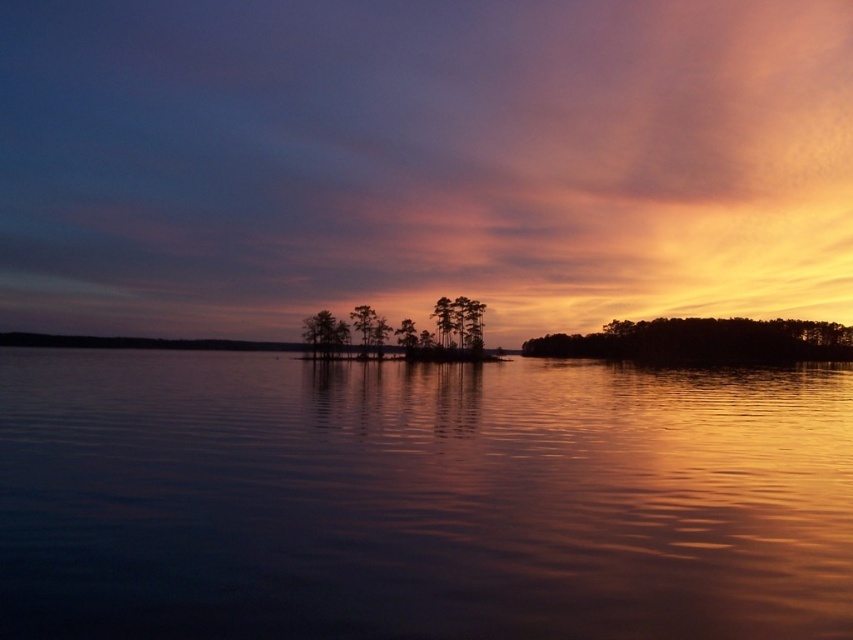
Which is above, orange/yellow cloud at upper center or silhouette pine tree at center?

orange/yellow cloud at upper center is above.

Is orange/yellow cloud at upper center bigger than silhouette pine tree at center?

Indeed, orange/yellow cloud at upper center has a larger size compared to silhouette pine tree at center.

Locate an element on the screen. This screenshot has width=853, height=640. orange/yellow cloud at upper center is located at coordinates (421, 163).

Is orange/yellow cloud at upper center closer to the viewer compared to silhouette tree at center?

No, it is not.

Who is more distant from viewer, (564, 298) or (364, 348)?

Point (564, 298)

This screenshot has height=640, width=853. What do you see at coordinates (421, 163) in the screenshot?
I see `orange/yellow cloud at upper center` at bounding box center [421, 163].

I want to click on orange/yellow cloud at upper center, so click(x=421, y=163).

I want to click on silky smooth trees at center, so click(x=447, y=332).

Is point (445, 346) closer to camera compared to point (442, 317)?

No, it is behind (442, 317).

The width and height of the screenshot is (853, 640). In order to click on silky smooth trees at center in this screenshot , I will do `click(447, 332)`.